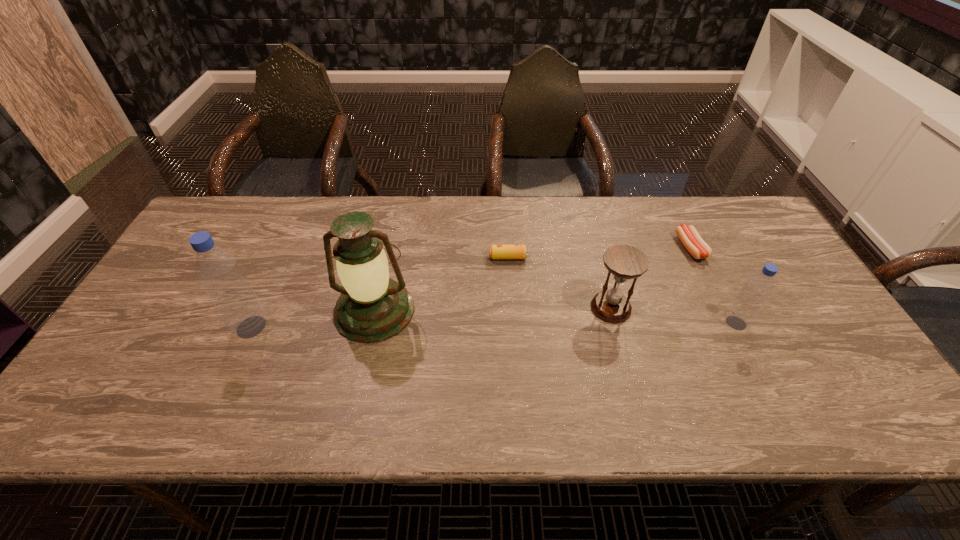
What are the coordinates of `free space between the lantern and the sausage` in the screenshot? It's located at (533, 279).

At what (x,y) coordinates should I click in order to perform the action: click on empty space that is in between the left bottle and the sausage. Please return your answer as a coordinate pair (x, y). The width and height of the screenshot is (960, 540). Looking at the image, I should click on (471, 287).

Find the location of a particular element. The width and height of the screenshot is (960, 540). vacant space that is in between the sausage and the right bottle is located at coordinates (713, 286).

The height and width of the screenshot is (540, 960). What are the coordinates of `free spot between the right bottle and the sausage` in the screenshot? It's located at (713, 286).

This screenshot has height=540, width=960. I want to click on blank region between the third object from right to left and the beer can, so click(560, 283).

Locate an element on the screen. vacant space that is in between the third object from right to left and the sausage is located at coordinates (651, 278).

The width and height of the screenshot is (960, 540). I want to click on free space between the sausage and the hourglass, so click(x=651, y=278).

Choose which object is the nearest neighbor to the taller bottle. Please provide its 2D coordinates. Your answer should be formatted as a tuple, i.e. [(x, y)], where the tuple contains the x and y coordinates of a point satisfying the conditions above.

[(372, 307)]

Locate which object is the second closest to the taller bottle. Please provide its 2D coordinates. Your answer should be formatted as a tuple, i.e. [(x, y)], where the tuple contains the x and y coordinates of a point satisfying the conditions above.

[(495, 251)]

The height and width of the screenshot is (540, 960). What are the coordinates of `vacant space that satisfies the following two spatial constraints: 1. on the front side of the hourglass; 2. on the right side of the shorter bottle` in the screenshot? It's located at (614, 323).